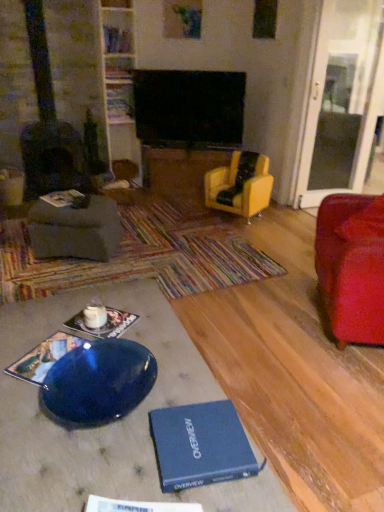
Question: From a real-world perspective, is glossy blue plate at lower left physically above blue hardcover book at lower left, the fifth book in the top-to-bottom sequence?

Choices:
 (A) no
 (B) yes

Answer: (A)

Question: Is glossy blue plate at lower left positioned before blue hardcover book at lower left, the fifth book in the top-to-bottom sequence?

Choices:
 (A) yes
 (B) no

Answer: (A)

Question: Does glossy blue plate at lower left have a larger size compared to blue hardcover book at lower left, the fifth book in the top-to-bottom sequence?

Choices:
 (A) no
 (B) yes

Answer: (B)

Question: From the image's perspective, would you say glossy blue plate at lower left is shown under blue hardcover book at lower left, the fifth book in the top-to-bottom sequence?

Choices:
 (A) no
 (B) yes

Answer: (A)

Question: Considering the relative sizes of glossy blue plate at lower left and blue hardcover book at lower left, which is counted as the second book, starting from the front, in the image provided, is glossy blue plate at lower left shorter than blue hardcover book at lower left, which is counted as the second book, starting from the front,?

Choices:
 (A) yes
 (B) no

Answer: (B)

Question: From a real-world perspective, is yellow leather armchair at center, marked as the 2th chair in a right-to-left arrangement, above or below matte gray footrest at left?

Choices:
 (A) above
 (B) below

Answer: (A)

Question: From the image's perspective, is yellow leather armchair at center, acting as the 1th chair starting from the back, positioned above or below matte gray footrest at left?

Choices:
 (A) above
 (B) below

Answer: (A)

Question: Visually, is yellow leather armchair at center, marked as the second chair in a front-to-back arrangement, positioned to the left or to the right of matte gray footrest at left?

Choices:
 (A) left
 (B) right

Answer: (B)

Question: Which is correct: yellow leather armchair at center, acting as the 1th chair starting from the back, is inside matte gray footrest at left, or outside of it?

Choices:
 (A) outside
 (B) inside

Answer: (A)

Question: Is point (201, 413) closer or farther from the camera than point (132, 72)?

Choices:
 (A) farther
 (B) closer

Answer: (B)

Question: Considering the positions of blue hardcover book at lower center and hardcover book at upper center, arranged as the 1th book when viewed from the back, in the image, is blue hardcover book at lower center wider or thinner than hardcover book at upper center, arranged as the 1th book when viewed from the back,?

Choices:
 (A) thin
 (B) wide

Answer: (B)

Question: Considering the relative positions of blue hardcover book at lower center and hardcover book at upper center, which is counted as the 5th book, starting from the bottom, in the image provided, is blue hardcover book at lower center to the left or to the right of hardcover book at upper center, which is counted as the 5th book, starting from the bottom,?

Choices:
 (A) left
 (B) right

Answer: (B)

Question: Is blue hardcover book at lower center bigger or smaller than hardcover book at upper center, which is counted as the 5th book, starting from the bottom?

Choices:
 (A) big
 (B) small

Answer: (B)

Question: From the image's perspective, is velvet red armchair at right, which is the 2th chair in back-to-front order, positioned above or below matte gray footrest at left?

Choices:
 (A) above
 (B) below

Answer: (B)

Question: Based on their sizes in the image, would you say velvet red armchair at right, marked as the 1th chair in a front-to-back arrangement, is bigger or smaller than matte gray footrest at left?

Choices:
 (A) small
 (B) big

Answer: (B)